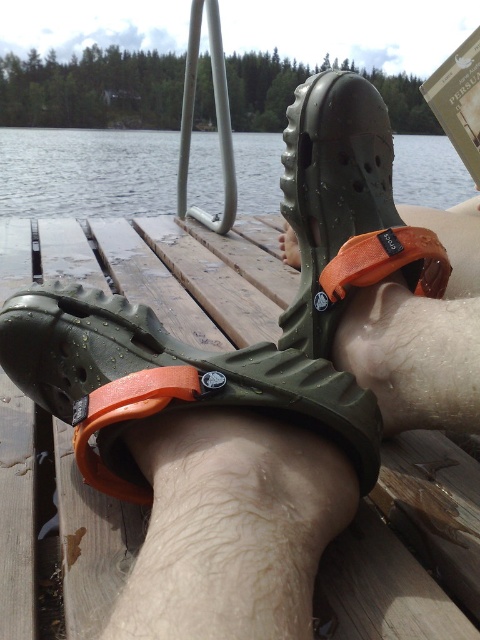
Between olive green rubber sandal at center and clear water at dock center, which one appears on the right side from the viewer's perspective?

From the viewer's perspective, olive green rubber sandal at center appears more on the right side.

Who is higher up, olive green rubber sandal at center or clear water at dock center?

clear water at dock center

Who is more distant from viewer, (218, 376) or (70, 204)?

Positioned behind is point (70, 204).

The height and width of the screenshot is (640, 480). In order to click on olive green rubber sandal at center in this screenshot , I will do `click(165, 381)`.